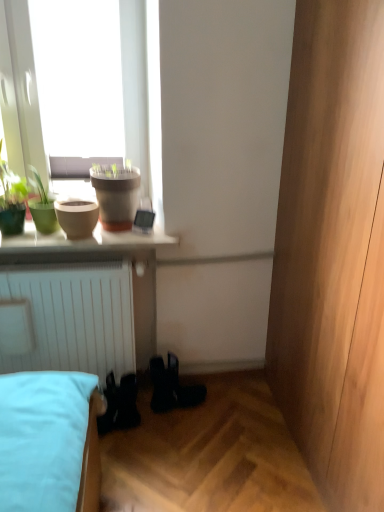
Question: In the image, is white glossy shelf at upper center on the left side or the right side of matte clay pot at upper left, which is counted as the 2th flowerpot, starting from the left?

Choices:
 (A) left
 (B) right

Answer: (A)

Question: Is point (46, 244) closer or farther from the camera than point (137, 173)?

Choices:
 (A) farther
 (B) closer

Answer: (B)

Question: Which of these objects is positioned closest to the black rubber boots at lower center?

Choices:
 (A) matte clay pot at upper left, which is counted as the 2th flowerpot, starting from the left
 (B) green matte plant at upper left, the second houseplant when ordered from right to left
 (C) white glossy shelf at upper center
 (D) matte beige flowerpot at left, the second flowerpot viewed from the right
 (E) green matte pot at upper left, the second houseplant in the left-to-right sequence

Answer: (C)

Question: Based on their relative distances, which object is nearer to the matte clay pot at upper left, which is counted as the 2th flowerpot, starting from the left?

Choices:
 (A) green matte pot at upper left, the second houseplant in the left-to-right sequence
 (B) green matte plant at upper left, the second houseplant when ordered from right to left
 (C) white glossy shelf at upper center
 (D) matte beige flowerpot at left, the 1th flowerpot viewed from the left
 (E) black rubber boots at lower center

Answer: (D)